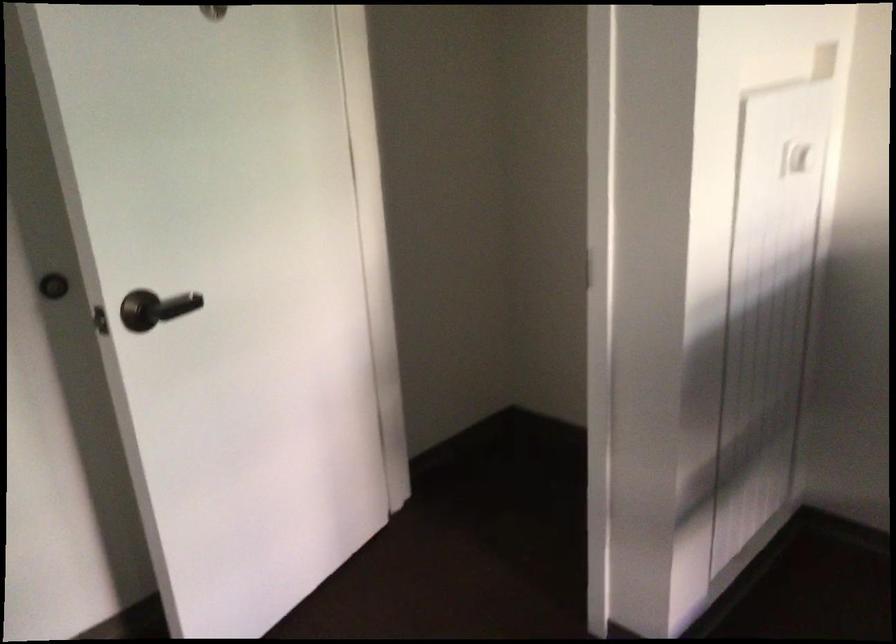
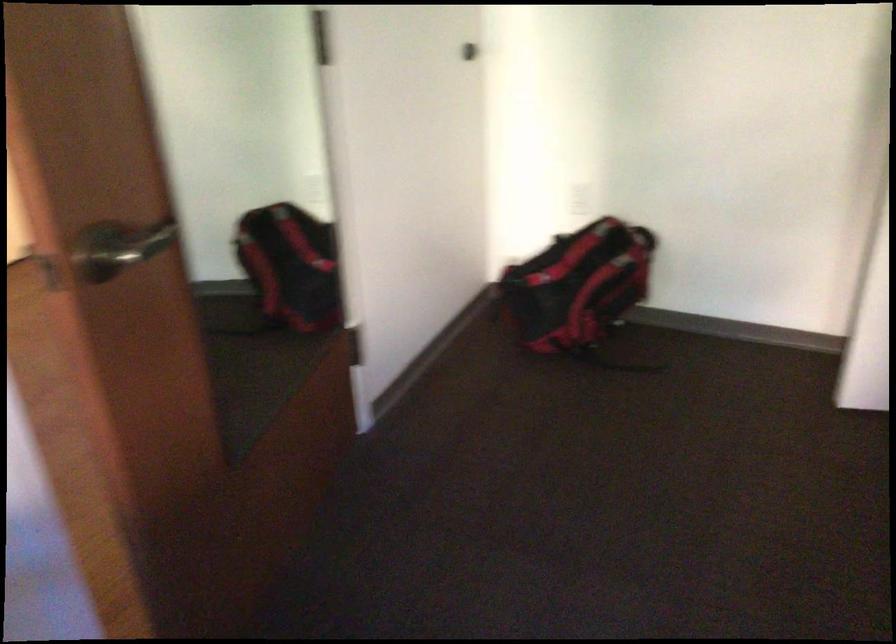
The first image is from the beginning of the video and the second image is from the end. How did the camera likely rotate when shooting the video?

The camera's rotation is toward left-down.